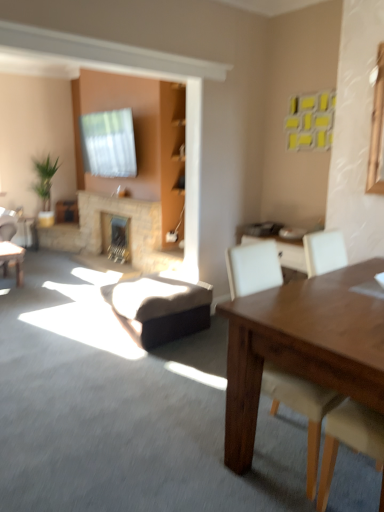
Question: Considering the relative positions of natural stone fireplace at center, positioned as the 1th fireplace in front-to-back order, and green leafy plant at left in the image provided, is natural stone fireplace at center, positioned as the 1th fireplace in front-to-back order, behind green leafy plant at left?

Choices:
 (A) yes
 (B) no

Answer: (B)

Question: Can you confirm if natural stone fireplace at center, which ranks as the second fireplace in back-to-front order, is wider than green leafy plant at left?

Choices:
 (A) yes
 (B) no

Answer: (B)

Question: From the image's perspective, is natural stone fireplace at center, which ranks as the second fireplace in back-to-front order, under green leafy plant at left?

Choices:
 (A) yes
 (B) no

Answer: (A)

Question: Is natural stone fireplace at center, which ranks as the second fireplace in back-to-front order, to the right of green leafy plant at left from the viewer's perspective?

Choices:
 (A) no
 (B) yes

Answer: (B)

Question: Can you confirm if natural stone fireplace at center, which ranks as the second fireplace in back-to-front order, is thinner than green leafy plant at left?

Choices:
 (A) yes
 (B) no

Answer: (A)

Question: Considering the positions of white leather chair at right and stone fireplace at center, the first fireplace positioned from the back, in the image, is white leather chair at right wider or thinner than stone fireplace at center, the first fireplace positioned from the back,?

Choices:
 (A) wide
 (B) thin

Answer: (A)

Question: From the image's perspective, is white leather chair at right located above or below stone fireplace at center, the 2th fireplace in the front-to-back sequence?

Choices:
 (A) below
 (B) above

Answer: (A)

Question: Does point (312, 422) appear closer or farther from the camera than point (122, 221)?

Choices:
 (A) closer
 (B) farther

Answer: (A)

Question: From a real-world perspective, is white leather chair at right physically located above or below stone fireplace at center, the first fireplace positioned from the back?

Choices:
 (A) above
 (B) below

Answer: (A)

Question: Is stone fireplace at center, the 2th fireplace in the front-to-back sequence, bigger or smaller than green leafy plant at left?

Choices:
 (A) small
 (B) big

Answer: (A)

Question: From the image's perspective, is stone fireplace at center, the 2th fireplace in the front-to-back sequence, located above or below green leafy plant at left?

Choices:
 (A) above
 (B) below

Answer: (B)

Question: From their relative heights in the image, would you say stone fireplace at center, the 2th fireplace in the front-to-back sequence, is taller or shorter than green leafy plant at left?

Choices:
 (A) short
 (B) tall

Answer: (A)

Question: Is stone fireplace at center, the 2th fireplace in the front-to-back sequence, wider or thinner than green leafy plant at left?

Choices:
 (A) wide
 (B) thin

Answer: (B)

Question: Considering the positions of natural stone fireplace at center, which ranks as the second fireplace in back-to-front order, and stone fireplace at center, the first fireplace positioned from the back, in the image, is natural stone fireplace at center, which ranks as the second fireplace in back-to-front order, bigger or smaller than stone fireplace at center, the first fireplace positioned from the back,?

Choices:
 (A) big
 (B) small

Answer: (A)

Question: Considering their positions, is natural stone fireplace at center, which ranks as the second fireplace in back-to-front order, located in front of or behind stone fireplace at center, the first fireplace positioned from the back?

Choices:
 (A) behind
 (B) front

Answer: (B)